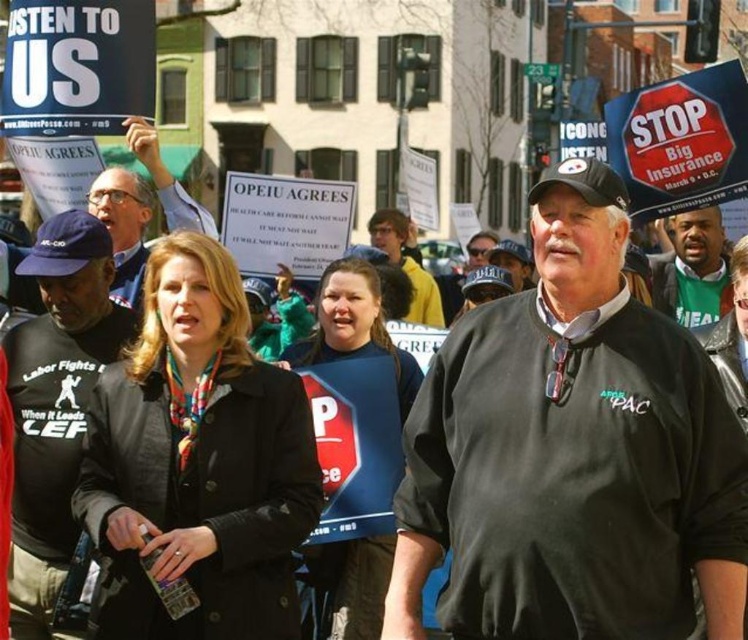
Is black matte jacket at center to the right of black jacket at center from the viewer's perspective?

Correct, you'll find black matte jacket at center to the right of black jacket at center.

Does point (702, 593) lie in front of point (18, 276)?

Yes, it is.

Locate an element on the screen. black matte jacket at center is located at coordinates (571, 452).

Can you confirm if black fabric shirt at left is bigger than black jacket at center?

No, black fabric shirt at left is not bigger than black jacket at center.

Who is positioned more to the left, black fabric shirt at left or black jacket at center?

Positioned to the left is black jacket at center.

You are a GUI agent. You are given a task and a screenshot of the screen. Output one action in this format:
    pyautogui.click(x=<x>, y=<y>)
    Task: Click on the black fabric shirt at left
    This screenshot has width=748, height=640.
    Given the screenshot: What is the action you would take?
    pyautogui.click(x=55, y=404)

The height and width of the screenshot is (640, 748). What do you see at coordinates (571, 452) in the screenshot?
I see `black matte jacket at center` at bounding box center [571, 452].

Based on the photo, which of these two, black matte jacket at center or green fabric shirt at right, stands shorter?

green fabric shirt at right

Is point (444, 618) less distant than point (671, 225)?

That is True.

Where is `black matte jacket at center`? black matte jacket at center is located at coordinates (571, 452).